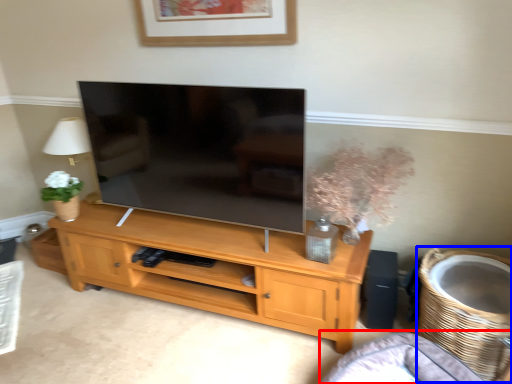
Question: Among these objects, which one is nearest to the camera, couch (highlighted by a red box) or basket (highlighted by a blue box)?

Choices:
 (A) couch
 (B) basket

Answer: (A)